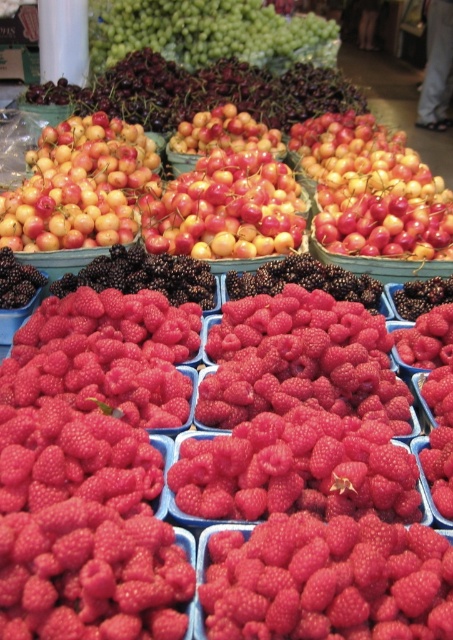
Does glossy yellow cherry at upper left have a smaller size compared to green matte grapes at upper center?

Indeed, glossy yellow cherry at upper left has a smaller size compared to green matte grapes at upper center.

Is glossy yellow cherry at upper left positioned in front of green matte grapes at upper center?

That is True.

Where is `glossy yellow cherry at upper left`? glossy yellow cherry at upper left is located at coordinates (80, 186).

At what (x,y) coordinates should I click in order to perform the action: click on glossy yellow cherry at upper left. Please return your answer as a coordinate pair (x, y). The image size is (453, 640). Looking at the image, I should click on (80, 186).

Does shiny black berries at center have a greater height compared to black matte/blackberry at upper left?

Indeed, shiny black berries at center has a greater height compared to black matte/blackberry at upper left.

Can you confirm if shiny black berries at center is thinner than black matte/blackberry at upper left?

No.

Identify the location of shiny black berries at center. (144, 275).

Does bright red raspberry at center have a larger size compared to shiny black berries at center?

Incorrect, bright red raspberry at center is not larger than shiny black berries at center.

Does bright red raspberry at center have a smaller size compared to shiny black berries at center?

Yes.

Between point (337, 552) and point (82, 284), which one is positioned in front?

Point (337, 552)

The height and width of the screenshot is (640, 453). In order to click on bright red raspberry at center in this screenshot , I will do `click(327, 580)`.